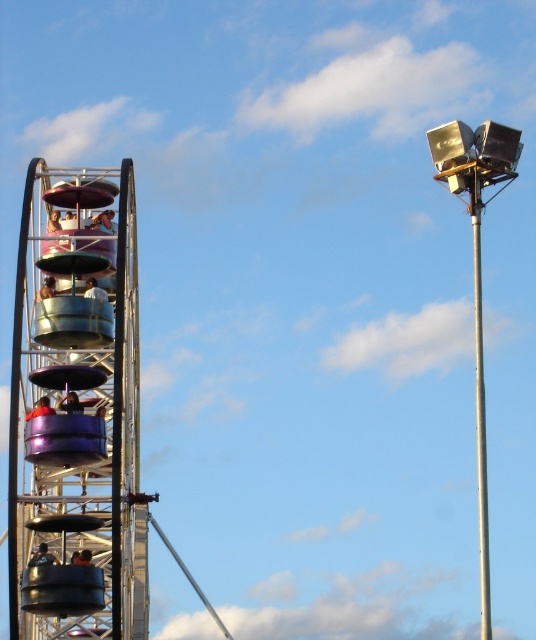
Is point (25, 419) positioned in front of point (90, 291)?

Yes, point (25, 419) is in front of point (90, 291).

This screenshot has height=640, width=536. In order to click on orange fabric seat at left in this screenshot , I will do 40,408.

Where is `orange fabric seat at left`? The image size is (536, 640). orange fabric seat at left is located at coordinates (40, 408).

Can you confirm if matte purple seat at upper left is bigger than orange fabric seat at left?

Yes.

Where is `matte purple seat at upper left`? matte purple seat at upper left is located at coordinates (102, 220).

Locate an element on the screen. This screenshot has height=640, width=536. orange fabric seat at left is located at coordinates (40, 408).

Locate an element on the screen. The height and width of the screenshot is (640, 536). orange fabric seat at left is located at coordinates (40, 408).

What are the coordinates of `orange fabric seat at left` in the screenshot? It's located at (40, 408).